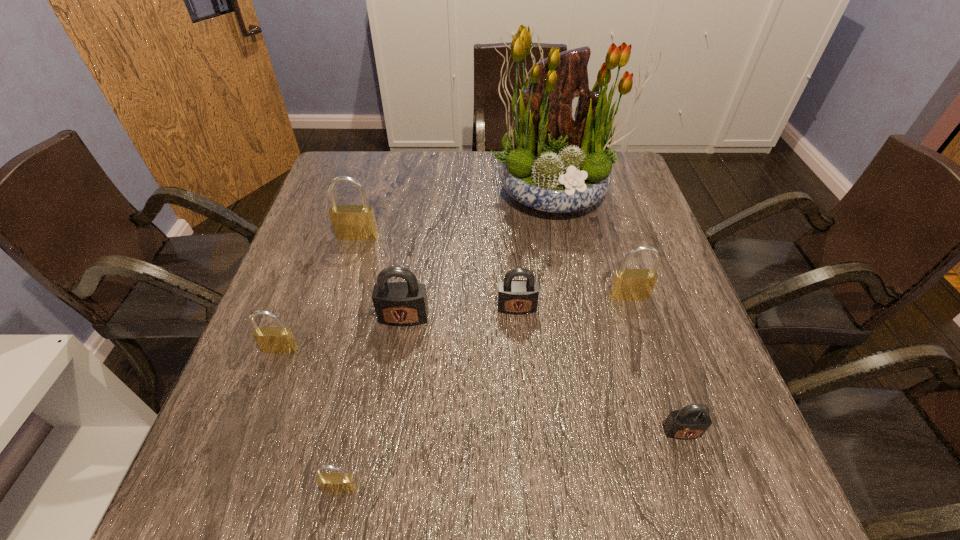
At what (x,y) coordinates should I click in order to perform the action: click on the leftmost brass padlock. Please return your answer as a coordinate pair (x, y). Looking at the image, I should click on (279, 339).

Identify the location of the sixth farthest padlock. The height and width of the screenshot is (540, 960). (692, 421).

Locate an element on the screen. Image resolution: width=960 pixels, height=540 pixels. the smallest gray padlock is located at coordinates (692, 421).

Locate an element on the screen. This screenshot has width=960, height=540. the second brass padlock from right to left is located at coordinates (333, 483).

Locate an element on the screen. the nearest brass padlock is located at coordinates (333, 483).

Identify the location of vacant space located 0.190m on the front-facing side of the farthest object. point(572,278).

This screenshot has width=960, height=540. I want to click on vacant space situated 0.330m on the front-facing side of the farthest brass padlock, so click(x=324, y=347).

Locate an element on the screen. The image size is (960, 540). vacant area located 0.150m on the front-facing side of the second farthest brass padlock is located at coordinates (648, 357).

The height and width of the screenshot is (540, 960). I want to click on vacant space located 0.290m on the front of the leftmost gray padlock near the keyhole, so click(381, 467).

Identify the location of free spot located 0.240m on the front of the second gray padlock from right to left near the keyhole. (525, 420).